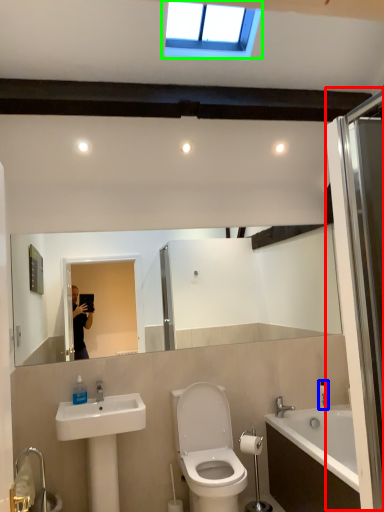
Question: Estimate the real-world distances between objects in this image. Which object is farther from screen door (highlighted by a red box), toiletry (highlighted by a blue box) or window (highlighted by a green box)?

Choices:
 (A) toiletry
 (B) window

Answer: (A)